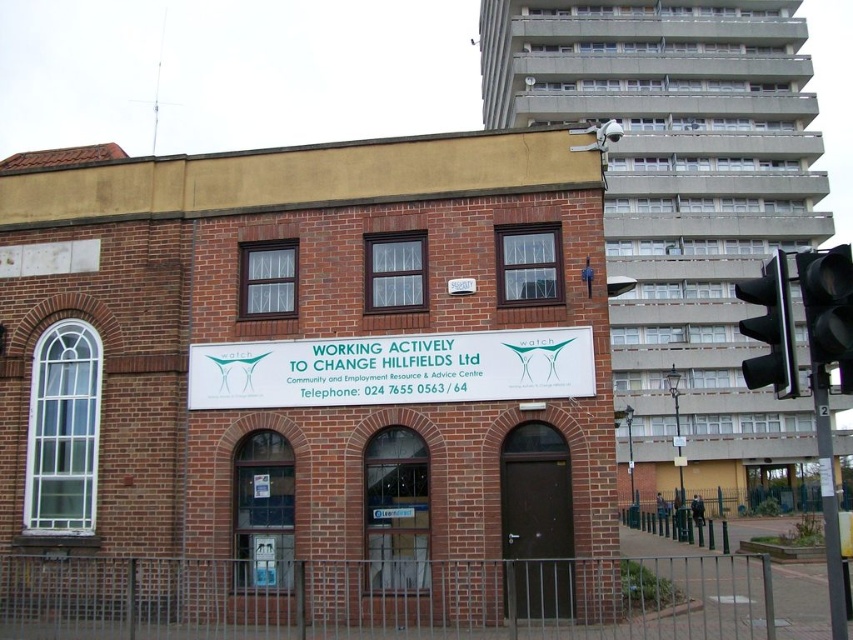
You are standing in front of the building and want to take a photo of the white plastic sign at center. You have a camera that has a maximum range of 50 feet. Can you capture the sign from your current position?

The white plastic sign at center and camera are 57.03 feet apart from each other. Since the camera has a maximum range of 50 feet, you cannot capture the sign from your current position.

You are standing in front of the brick building and want to read the white plastic sign at center and the black metal traffic light at right. Which object is closer to you?

The white plastic sign at center is closer to you than the black metal traffic light at right.